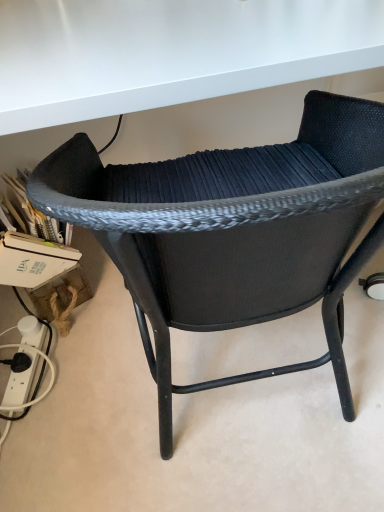
The height and width of the screenshot is (512, 384). What do you see at coordinates (30, 362) in the screenshot?
I see `black plastic plug at lower left` at bounding box center [30, 362].

This screenshot has height=512, width=384. Identify the location of black plastic plug at lower left. (30, 362).

From the picture: What is the approximate height of black plastic plug at lower left?

1.42 inches.

Locate an element on the screen. The height and width of the screenshot is (512, 384). black woven chair at center is located at coordinates (232, 232).

Image resolution: width=384 pixels, height=512 pixels. What do you see at coordinates (232, 232) in the screenshot? I see `black woven chair at center` at bounding box center [232, 232].

Locate an element on the screen. This screenshot has width=384, height=512. black plastic plug at lower left is located at coordinates coord(30,362).

Which is more to the left, black plastic plug at lower left or black woven chair at center?

Positioned to the left is black plastic plug at lower left.

Does black plastic plug at lower left lie in front of black woven chair at center?

No, it is not.

Does point (41, 346) come in front of point (347, 124)?

No.

From the image's perspective, between black plastic plug at lower left and black woven chair at center, which one is located above?

black woven chair at center is shown above in the image.

From a real-world perspective, who is located lower, black plastic plug at lower left or black woven chair at center?

In real-world perspective, black plastic plug at lower left is lower.

Looking at this image, can you confirm if black plastic plug at lower left is thinner than black woven chair at center?

Indeed, black plastic plug at lower left has a lesser width compared to black woven chair at center.

From the picture: Considering the sizes of objects black plastic plug at lower left and black woven chair at center in the image provided, who is taller, black plastic plug at lower left or black woven chair at center?

black woven chair at center is taller.

Consider the image. Looking at the image, does black plastic plug at lower left seem bigger or smaller compared to black woven chair at center?

Considering their sizes, black plastic plug at lower left takes up less space than black woven chair at center.

Would you say black plastic plug at lower left is outside black woven chair at center?

Yes.

Is black plastic plug at lower left beside black woven chair at center?

No, black plastic plug at lower left is not in contact with black woven chair at center.

Is black plastic plug at lower left oriented away from black woven chair at center?

No, black plastic plug at lower left's orientation is not away from black woven chair at center.

Can you tell me how much black plastic plug at lower left and black woven chair at center differ in facing direction?

The angle between the facing direction of black plastic plug at lower left and the facing direction of black woven chair at center is 102 degrees.

How much distance is there between black plastic plug at lower left and black woven chair at center?

black plastic plug at lower left is 65.81 centimeters from black woven chair at center.

Image resolution: width=384 pixels, height=512 pixels. There is a black plastic plug at lower left. In order to click on chair above it (from a real-world perspective) in this screenshot , I will do `click(232, 232)`.

Considering the relative positions of black woven chair at center and black plastic plug at lower left in the image provided, is black woven chair at center to the left of black plastic plug at lower left from the viewer's perspective?

No.

Which object is further away from the camera taking this photo, black woven chair at center or black plastic plug at lower left?

Positioned behind is black plastic plug at lower left.

Does point (211, 183) appear closer or farther from the camera than point (42, 328)?

Point (211, 183).

From the image's perspective, is black woven chair at center positioned above or below black plastic plug at lower left?

black woven chair at center is situated higher than black plastic plug at lower left in the image.

From a real-world perspective, which object stands above the other?

black woven chair at center is physically above.

Looking at their sizes, would you say black woven chair at center is wider or thinner than black plastic plug at lower left?

In the image, black woven chair at center appears to be wider than black plastic plug at lower left.

Is black woven chair at center taller or shorter than black plastic plug at lower left?

Clearly, black woven chair at center is taller compared to black plastic plug at lower left.

Between black woven chair at center and black plastic plug at lower left, which one has smaller size?

Smaller between the two is black plastic plug at lower left.

Is black woven chair at center located outside black plastic plug at lower left?

Yes, black woven chair at center is outside of black plastic plug at lower left.

Is the surface of black woven chair at center in direct contact with black plastic plug at lower left?

No, black woven chair at center is not with black plastic plug at lower left.

Based on the photo, could you tell me if black woven chair at center is facing black plastic plug at lower left?

No.

Measure the distance from black woven chair at center to black plastic plug at lower left.

black woven chair at center and black plastic plug at lower left are 25.91 inches apart.

This screenshot has width=384, height=512. In order to click on plug on the left of black woven chair at center in this screenshot , I will do `click(30, 362)`.

Where is `plug behind the black woven chair at center`? This screenshot has width=384, height=512. plug behind the black woven chair at center is located at coordinates (30, 362).

Identify the location of plug on the left of black woven chair at center. This screenshot has height=512, width=384. (30, 362).